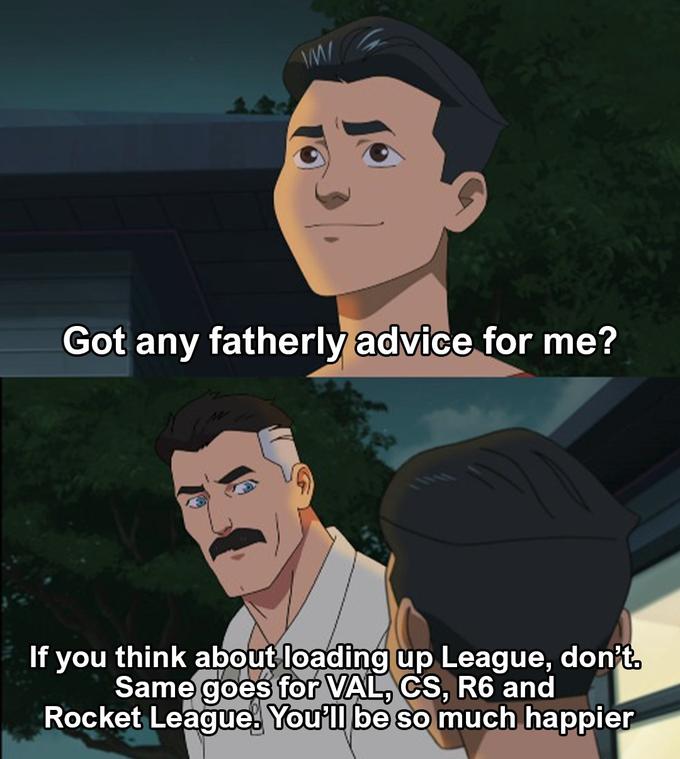
At what (x,y) coordinates should I click in order to perform the action: click on window. Please return your answer as a coordinate pair (x, y). Looking at the image, I should click on (668, 615).